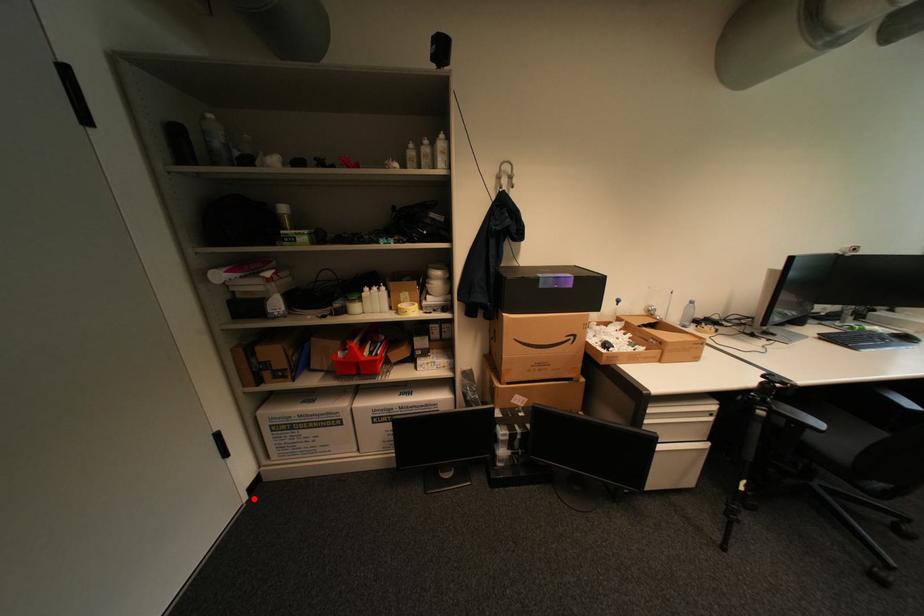
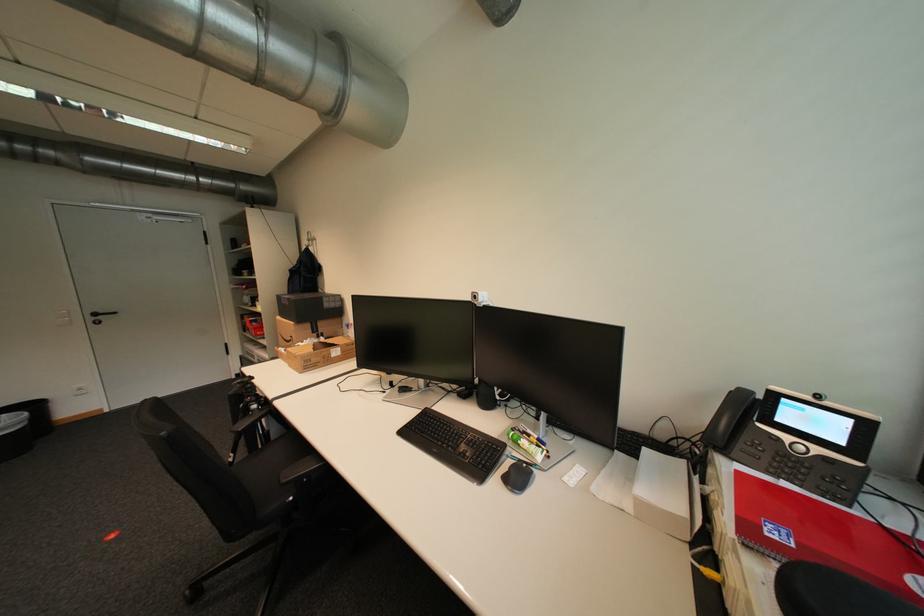
Locate, in the second image, the point that corresponds to the highlighted location in the first image.

(242, 378)